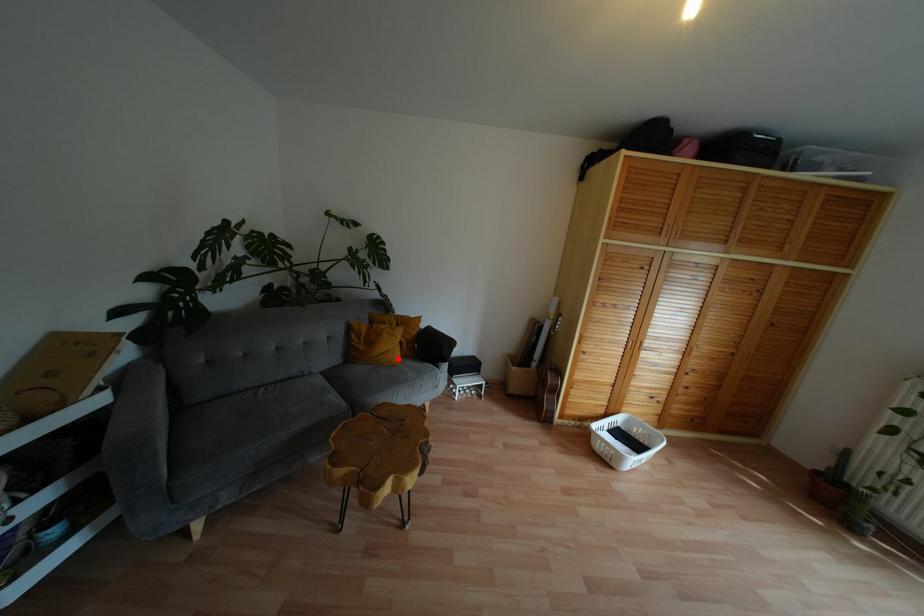
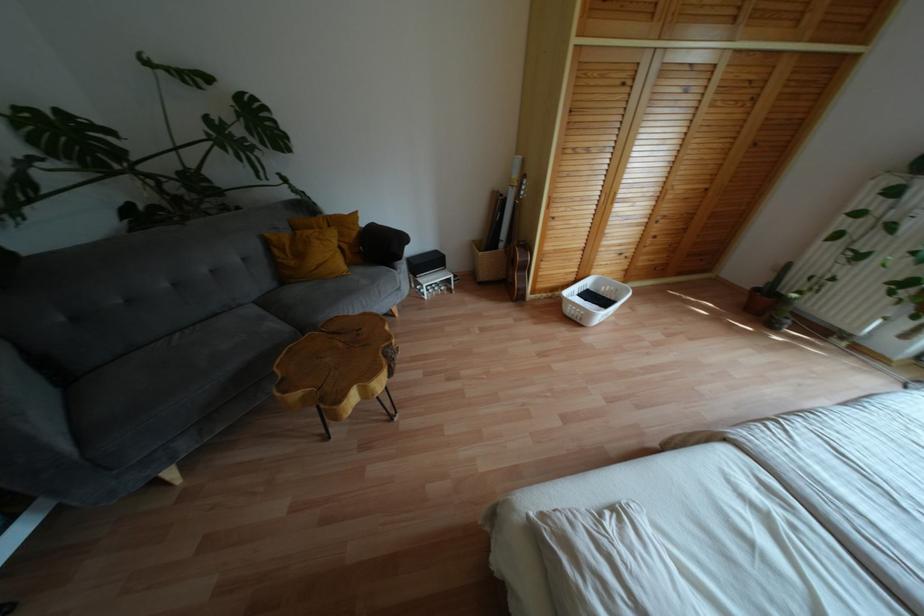
Question: I am providing you with two images of the same scene from different viewpoints. In image1, a red point is highlighted. Considering the same 3D point in image2, which of the following is correct?

Choices:
 (A) It is closer
 (B) It is farther

Answer: (A)